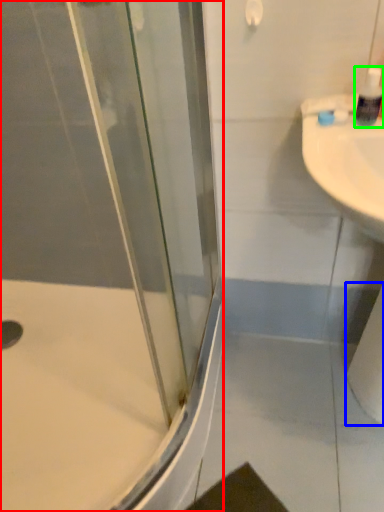
Question: Based on their relative distances, which object is nearer to shower door (highlighted by a red box)? Choose from toilet paper (highlighted by a blue box) and soap dispenser (highlighted by a green box).

Choices:
 (A) toilet paper
 (B) soap dispenser

Answer: (A)